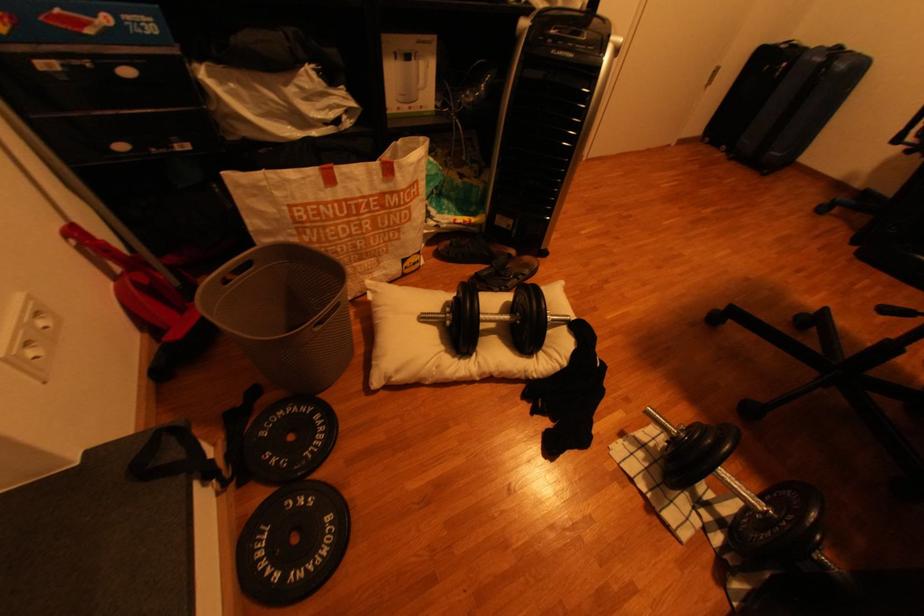
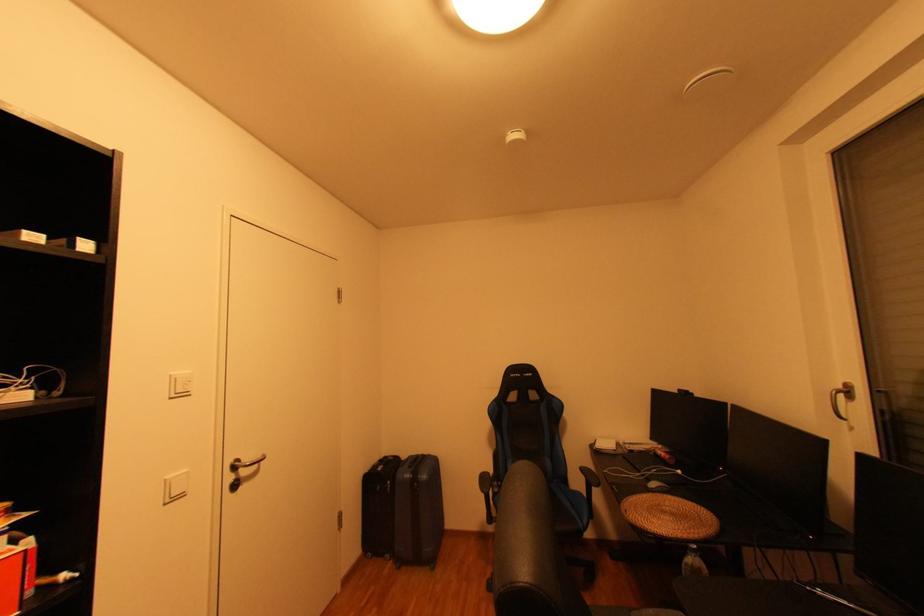
Locate, in the second image, the point that corresponds to point 719,139 in the first image.

(380, 554)